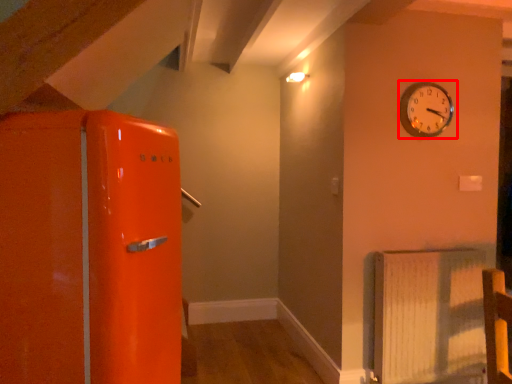
Question: From the image's perspective, what is the correct spatial relationship of wall clock (annotated by the red box) in relation to radiator?

Choices:
 (A) above
 (B) below

Answer: (A)